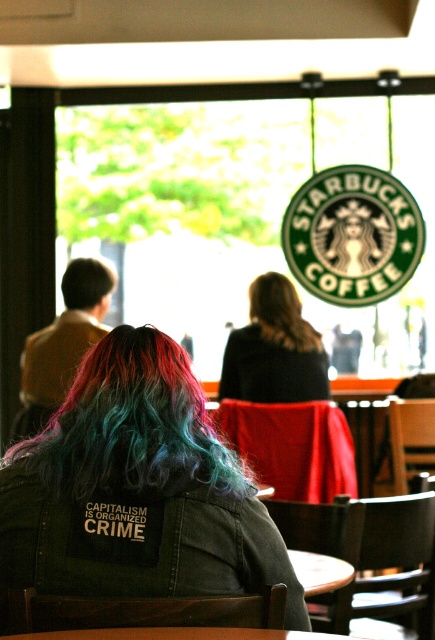
How distant is denim jacket at center from multicolored dyed hair at center?

denim jacket at center is 1.24 inches away from multicolored dyed hair at center.

Is denim jacket at center wider than multicolored dyed hair at center?

Correct, the width of denim jacket at center exceeds that of multicolored dyed hair at center.

Is point (244, 474) less distant than point (97, 436)?

No, it is not.

Identify the location of denim jacket at center. (136, 490).

Can you confirm if denim jacket at center is positioned to the left of brown matte hair at upper left?

In fact, denim jacket at center is to the right of brown matte hair at upper left.

You are a GUI agent. You are given a task and a screenshot of the screen. Output one action in this format:
    pyautogui.click(x=<x>, y=<y>)
    Task: Click on the denim jacket at center
    The image size is (435, 640).
    Given the screenshot: What is the action you would take?
    pyautogui.click(x=136, y=490)

You are a GUI agent. You are given a task and a screenshot of the screen. Output one action in this format:
    pyautogui.click(x=<x>, y=<y>)
    Task: Click on the denim jacket at center
    The height and width of the screenshot is (640, 435).
    Given the screenshot: What is the action you would take?
    pyautogui.click(x=136, y=490)

Measure the distance between point (x=268, y=344) and camera.

Point (x=268, y=344) and camera are 3.90 meters apart from each other.

Who is positioned more to the right, black matte jacket at center or brown matte hair at upper left?

Positioned to the right is black matte jacket at center.

Measure the distance between black matte jacket at center and camera.

black matte jacket at center is 3.86 meters from camera.

Find the location of a particular element. Image resolution: width=435 pixels, height=640 pixels. black matte jacket at center is located at coordinates (274, 349).